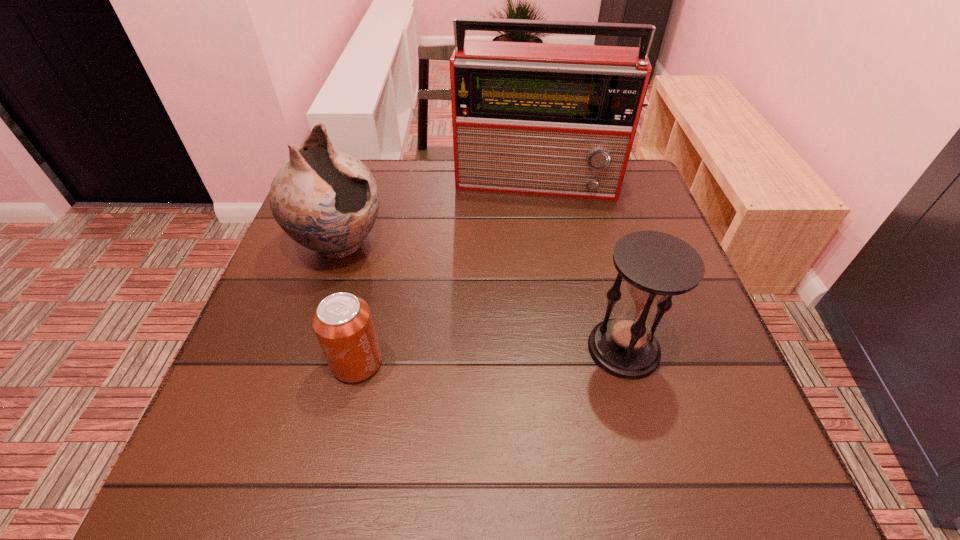
This screenshot has height=540, width=960. What are the coordinates of `vacant space at the far edge of the desktop` in the screenshot? It's located at (508, 202).

Identify the location of vacant area at the near edge. (413, 410).

The height and width of the screenshot is (540, 960). In the image, there is a desktop. What are the coordinates of `blank space at the left edge` in the screenshot? It's located at (332, 259).

The height and width of the screenshot is (540, 960). In the image, there is a desktop. What are the coordinates of `blank space at the right edge` in the screenshot? It's located at (622, 299).

Locate an element on the screen. The width and height of the screenshot is (960, 540). vacant region between the shortest object and the tallest object is located at coordinates (448, 271).

Locate an element on the screen. This screenshot has width=960, height=540. free space between the second shortest object and the shortest object is located at coordinates (491, 356).

Locate an element on the screen. empty space that is in between the farthest object and the pottery is located at coordinates (440, 212).

Where is `vacant point located between the farthest object and the can`? The width and height of the screenshot is (960, 540). vacant point located between the farthest object and the can is located at coordinates (448, 271).

I want to click on free space between the pottery and the farthest object, so click(x=440, y=212).

The image size is (960, 540). I want to click on blank region between the hourglass and the can, so click(491, 356).